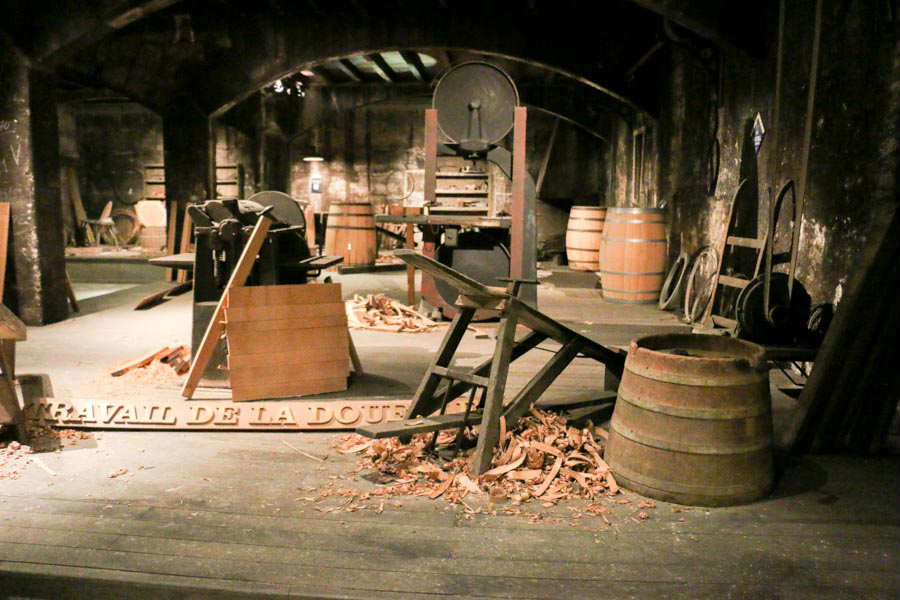
Image resolution: width=900 pixels, height=600 pixels. What are the coordinates of `wooden floor` in the screenshot? It's located at (741, 570), (255, 548), (105, 335), (401, 339).